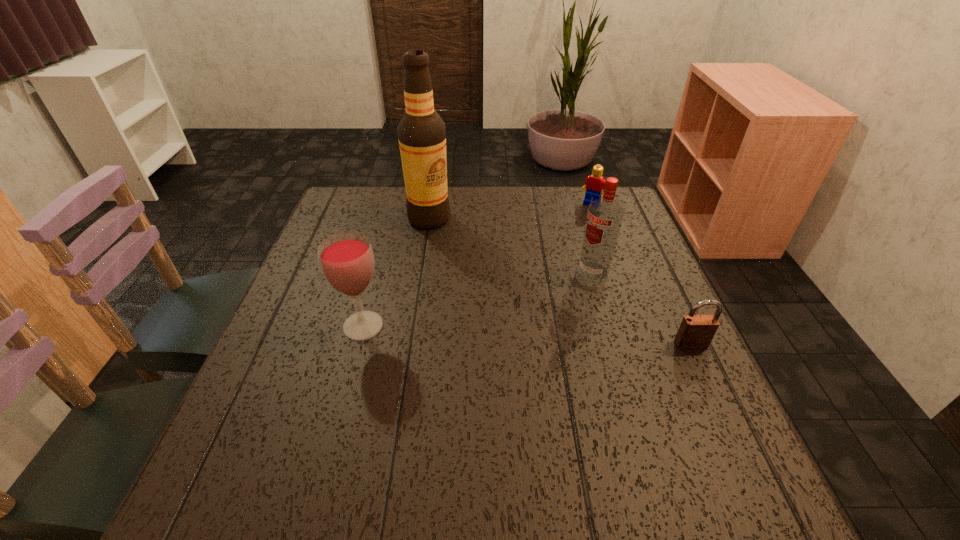
Locate an element on the screen. The height and width of the screenshot is (540, 960). wineglass is located at coordinates (346, 259).

Where is `padlock`? padlock is located at coordinates (696, 331).

Find the location of a particular element. vodka is located at coordinates (604, 217).

The width and height of the screenshot is (960, 540). In order to click on the second tallest object in this screenshot , I will do `click(604, 217)`.

This screenshot has width=960, height=540. What are the coordinates of `Lego` in the screenshot? It's located at (594, 184).

Locate an element on the screen. The width and height of the screenshot is (960, 540). alcohol is located at coordinates (421, 132).

You are a GUI agent. You are given a task and a screenshot of the screen. Output one action in this format:
    pyautogui.click(x=<x>, y=<y>)
    Task: Click on the blank space located on the right of the third shortest object
    The image size is (960, 540).
    Given the screenshot: What is the action you would take?
    pyautogui.click(x=409, y=326)

Image resolution: width=960 pixels, height=540 pixels. I want to click on free spot located 0.150m on the front-facing side of the rightmost object, so click(x=723, y=413).

This screenshot has width=960, height=540. Find the location of `vacant space located 0.120m on the front label of the third nearest object`. vacant space located 0.120m on the front label of the third nearest object is located at coordinates (551, 301).

You are a GUI agent. You are given a task and a screenshot of the screen. Output one action in this format:
    pyautogui.click(x=<x>, y=<y>)
    Task: Click on the free region located 0.290m on the front label of the third nearest object
    The width and height of the screenshot is (960, 540).
    Given the screenshot: What is the action you would take?
    pyautogui.click(x=499, y=339)